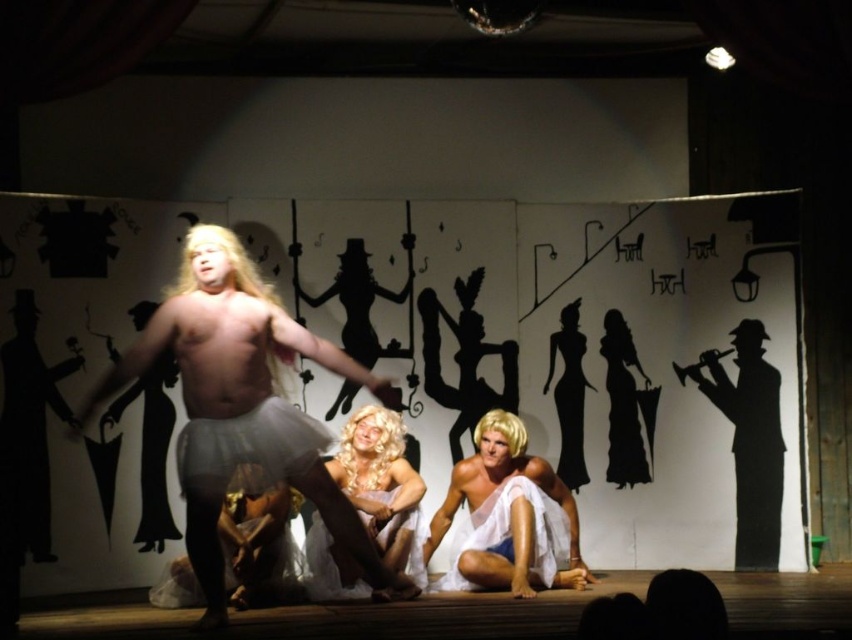
Question: In this image, where is blonde wig at center located relative to white sheer fabric at center?

Choices:
 (A) below
 (B) above

Answer: (B)

Question: Can you confirm if blonde wig at center is positioned above white sheer fabric at center?

Choices:
 (A) no
 (B) yes

Answer: (B)

Question: Which point is farther to the camera?

Choices:
 (A) white sheer fabric at center
 (B) black paper trumpet at right
 (C) white fabric draped at center
 (D) white sheer skirt at center

Answer: (B)

Question: Among these points, which one is farthest from the camera?

Choices:
 (A) (764, 412)
 (B) (399, 429)
 (C) (227, 438)
 (D) (481, 422)

Answer: (A)

Question: Can you confirm if blonde wig at center is positioned above black paper trumpet at right?

Choices:
 (A) yes
 (B) no

Answer: (B)

Question: Among these objects, which one is farthest from the camera?

Choices:
 (A) black paper trumpet at right
 (B) blonde wig at center
 (C) white fabric draped at center

Answer: (A)